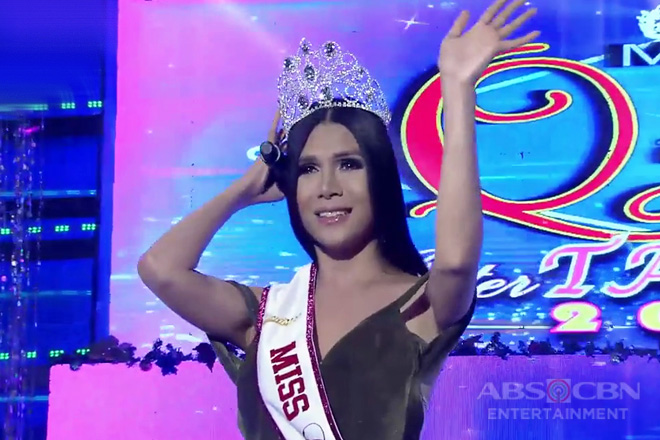
Where is `sash`? sash is located at coordinates pos(292,340).